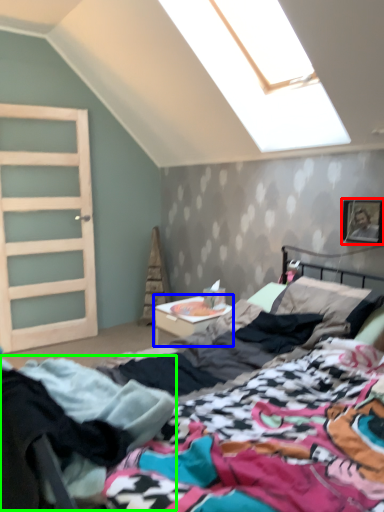
Question: Estimate the real-world distances between objects in this image. Which object is closer to picture frame (highlighted by a red box), nightstand (highlighted by a blue box) or clothing (highlighted by a green box)?

Choices:
 (A) nightstand
 (B) clothing

Answer: (A)